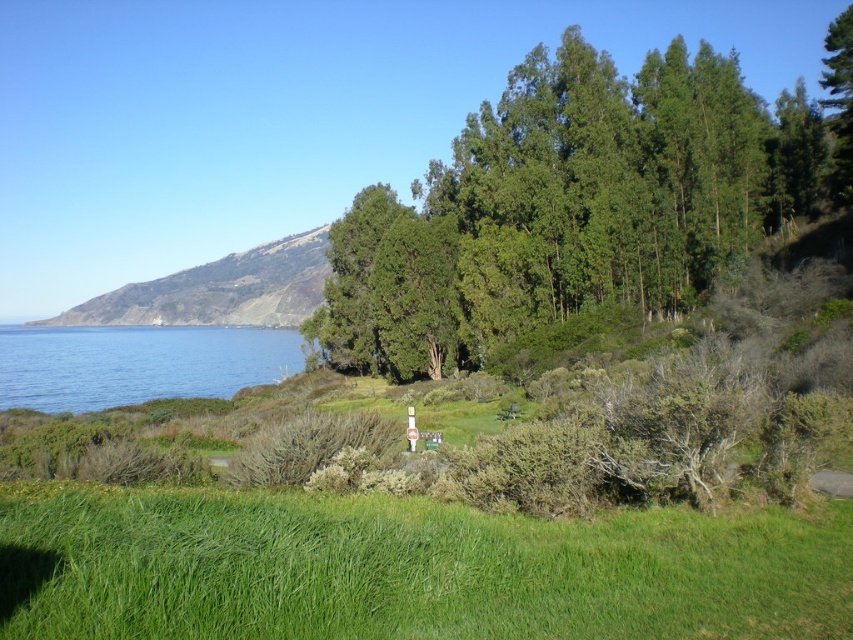
Image resolution: width=853 pixels, height=640 pixels. What are the coordinates of `green grassy field at lower center` in the screenshot? It's located at (410, 570).

Is green grassy field at lower center smaller than green leafy trees at center?

Correct, green grassy field at lower center occupies less space than green leafy trees at center.

At what (x,y) coordinates should I click in order to perform the action: click on green grassy field at lower center. Please return your answer as a coordinate pair (x, y). Looking at the image, I should click on (410, 570).

I want to click on green grassy field at lower center, so click(410, 570).

Can you confirm if green grassy field at lower center is positioned above blue water at lower left?

Indeed, green grassy field at lower center is positioned over blue water at lower left.

Between point (746, 616) and point (21, 348), which one is positioned in front?

Point (746, 616) is in front.

Where is `green grassy field at lower center`? The width and height of the screenshot is (853, 640). green grassy field at lower center is located at coordinates (410, 570).

Is point (161, 378) in front of point (306, 285)?

Yes, it is in front of point (306, 285).

Can you confirm if blue water at lower left is bigger than green grassy hillside at left?

No, blue water at lower left is not bigger than green grassy hillside at left.

The image size is (853, 640). I want to click on blue water at lower left, so click(x=136, y=364).